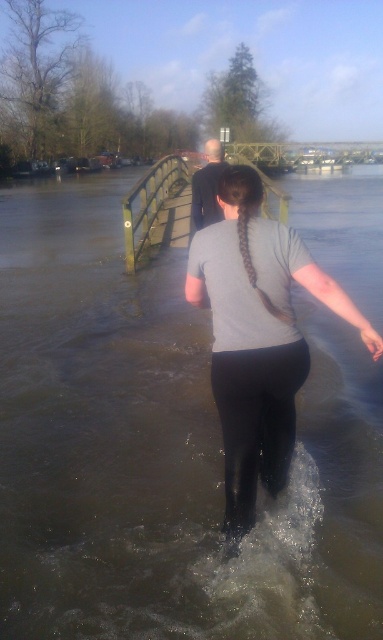
Question: Which of the following is the closest to the observer?

Choices:
 (A) wooden bridge at upper center
 (B) brown muddy water at center
 (C) smooth bald head at center

Answer: (B)

Question: Which point is farther to the camera?

Choices:
 (A) (266, 144)
 (B) (258, 224)

Answer: (A)

Question: Does gray matte shirt at center come behind wooden bridge at upper center?

Choices:
 (A) no
 (B) yes

Answer: (A)

Question: Is gray matte shirt at center closer to the viewer compared to smooth bald head at center?

Choices:
 (A) no
 (B) yes

Answer: (B)

Question: Does gray matte shirt at center lie behind smooth bald head at center?

Choices:
 (A) yes
 (B) no

Answer: (B)

Question: Which point is farther to the camera?

Choices:
 (A) (72, 440)
 (B) (207, 188)
 (C) (302, 148)
 (D) (260, 202)

Answer: (C)